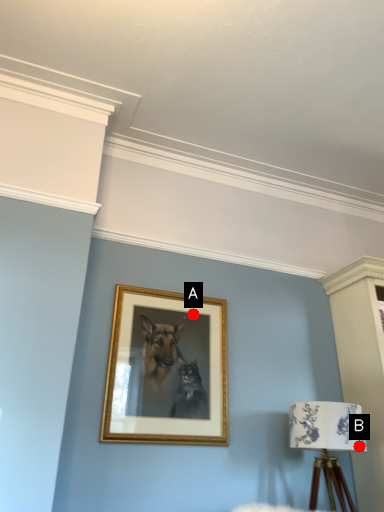
Question: Two points are circled on the image, labeled by A and B beside each circle. Among these points, which one is farthest from the camera?

Choices:
 (A) A is further
 (B) B is further

Answer: (A)